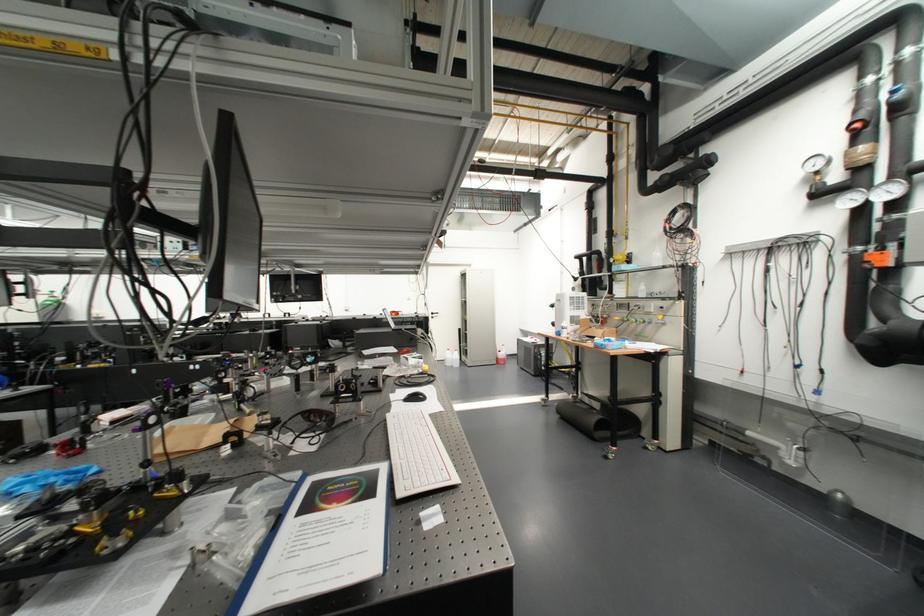
Describe the element at coordinates (447, 358) in the screenshot. This screenshot has width=924, height=616. I see `the clear plastic bottle` at that location.